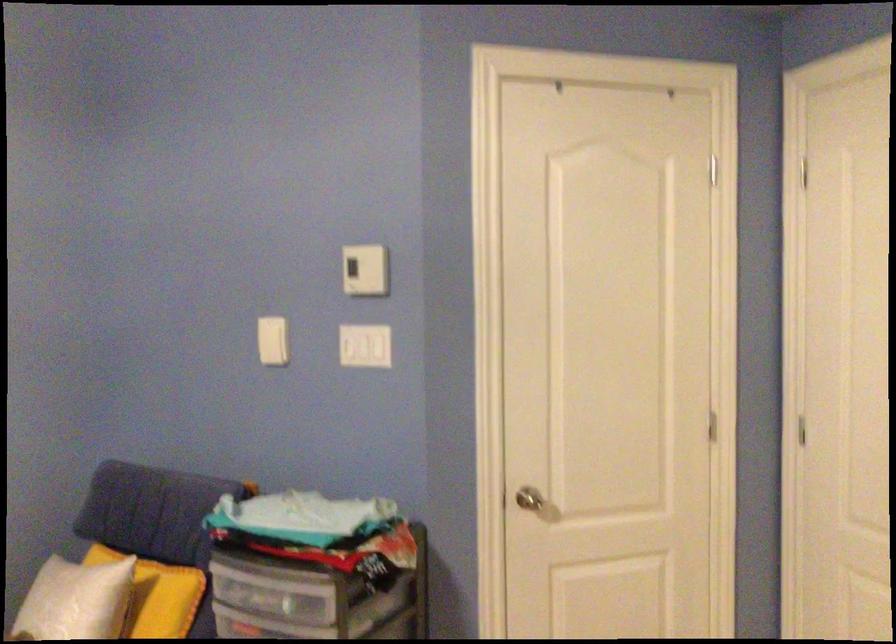
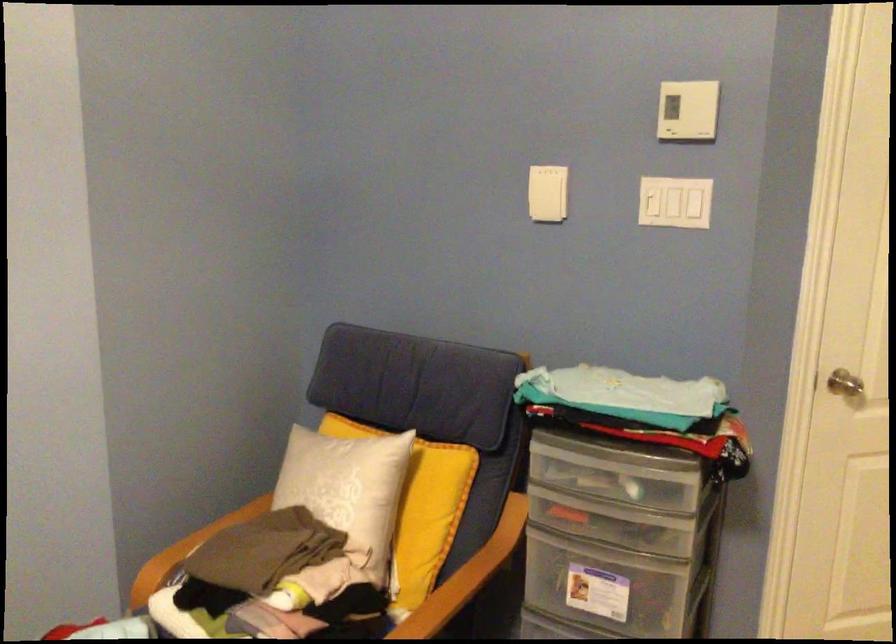
In the second image, find the point that corresponds to point (524, 500) in the first image.

(846, 384)